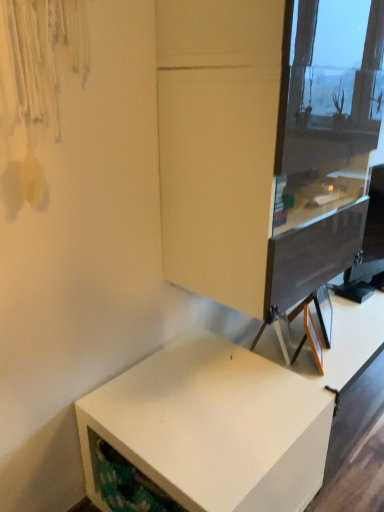
This screenshot has width=384, height=512. What do you see at coordinates (212, 428) in the screenshot? I see `white matte desk at lower left` at bounding box center [212, 428].

Measure the distance between point (328,438) and camera.

The distance of point (328,438) from camera is 1.38 meters.

Locate an element on the screen. The width and height of the screenshot is (384, 512). white matte desk at lower left is located at coordinates tap(212, 428).

Find the location of a particular element. The width and height of the screenshot is (384, 512). white matte desk at lower left is located at coordinates (212, 428).